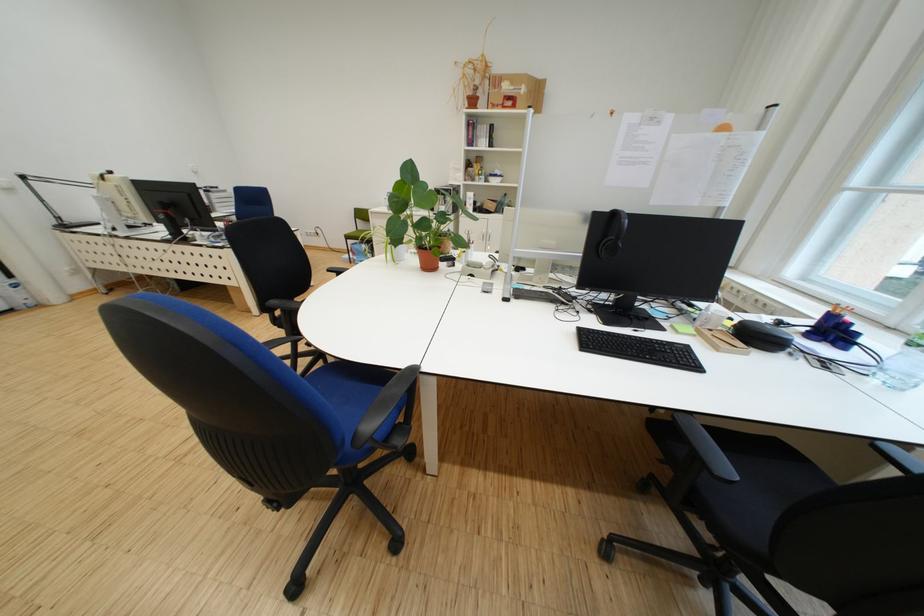
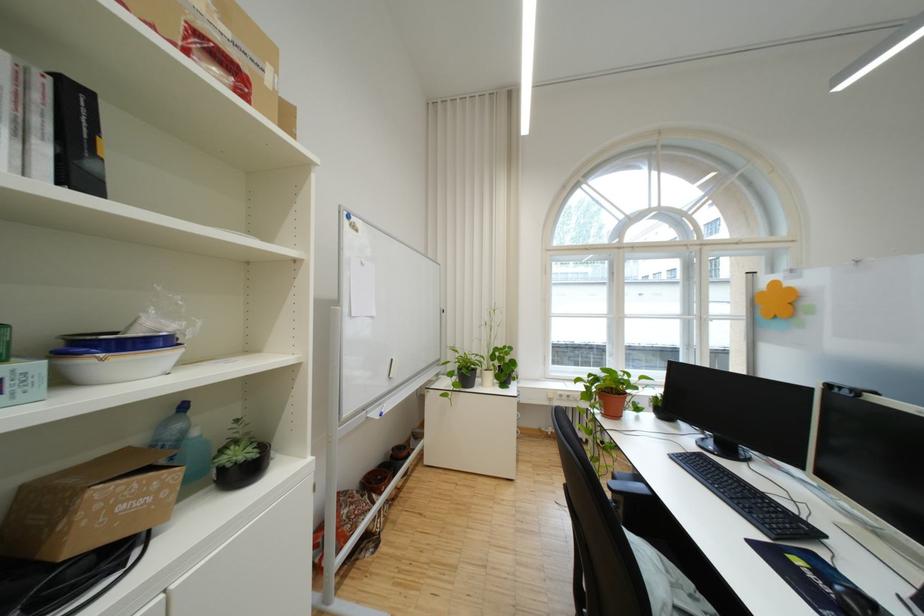
Find the pixel in the second image that matches [504,129] in the first image.

(88, 100)